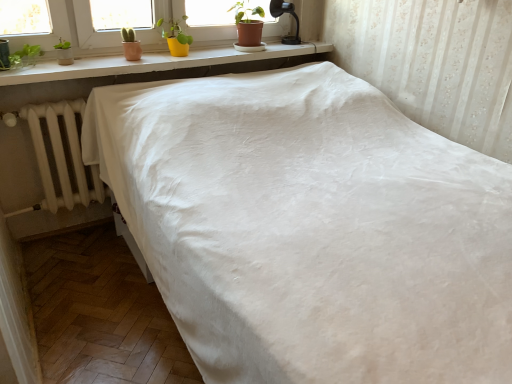
This screenshot has width=512, height=384. In order to click on vacant region below yellow matte pot at upper center, which is the second houseplant in right-to-left order (from a real-world perspective) in this screenshot , I will do `click(179, 57)`.